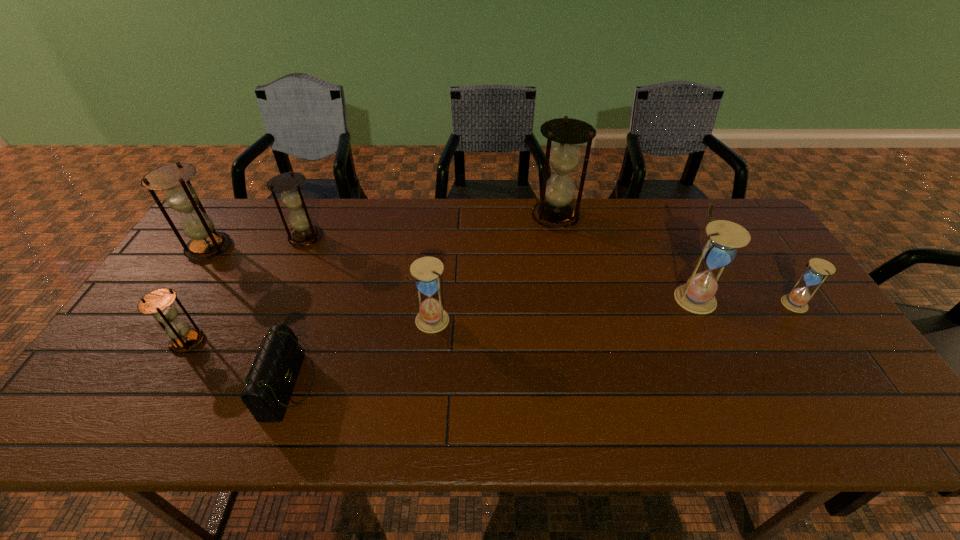
Find the location of a particular element. The image size is (960, 540). vacant space situated on the front flap of the clutch bag is located at coordinates (428, 386).

Locate an element on the screen. This screenshot has width=960, height=540. object present at the near edge is located at coordinates (273, 374).

Identify the location of object that is at the right edge. (818, 269).

You are a GUI agent. You are given a task and a screenshot of the screen. Output one action in this format:
    pyautogui.click(x=<x>, y=<y>)
    Task: Click on the object at the far left corner
    This screenshot has height=540, width=960.
    Given the screenshot: What is the action you would take?
    pyautogui.click(x=206, y=242)

I want to click on vacant space at the far edge, so click(x=442, y=214).

Locate an element on the screen. This screenshot has width=960, height=540. blank area at the near edge is located at coordinates (235, 413).

Find the location of a particular element. This screenshot has width=960, height=540. free region at the left edge of the desktop is located at coordinates (96, 376).

In the image, there is a desktop. Where is `vacant space at the right edge`? Image resolution: width=960 pixels, height=540 pixels. vacant space at the right edge is located at coordinates (823, 325).

Locate an element on the screen. vacant point at the far left corner is located at coordinates (220, 226).

What are the coordinates of `vacant area that lies between the fifth object from left to right and the smallest white hourglass` in the screenshot? It's located at (612, 312).